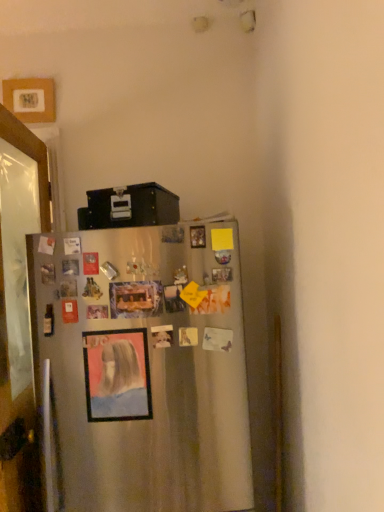
Question: In terms of size, does matte plastic picture frame at center, which ranks as the second picture frame in top-to-bottom order, appear bigger or smaller than satin silver fridge at center?

Choices:
 (A) small
 (B) big

Answer: (A)

Question: Relative to satin silver fridge at center, is matte plastic picture frame at center, positioned as the 1th picture frame in front-to-back order, in front or behind?

Choices:
 (A) behind
 (B) front

Answer: (A)

Question: Which of these objects is positioned farthest from the matte plastic picture frame at center, marked as the second picture frame in a left-to-right arrangement?

Choices:
 (A) clear glass door at left
 (B) satin silver fridge at center
 (C) wooden picture frame at upper left, the second picture frame positioned from the right

Answer: (C)

Question: Based on their relative distances, which object is farther from the satin silver fridge at center?

Choices:
 (A) matte plastic picture frame at center, positioned as the 1th picture frame in front-to-back order
 (B) clear glass door at left
 (C) wooden picture frame at upper left, marked as the first picture frame in a top-to-bottom arrangement

Answer: (C)